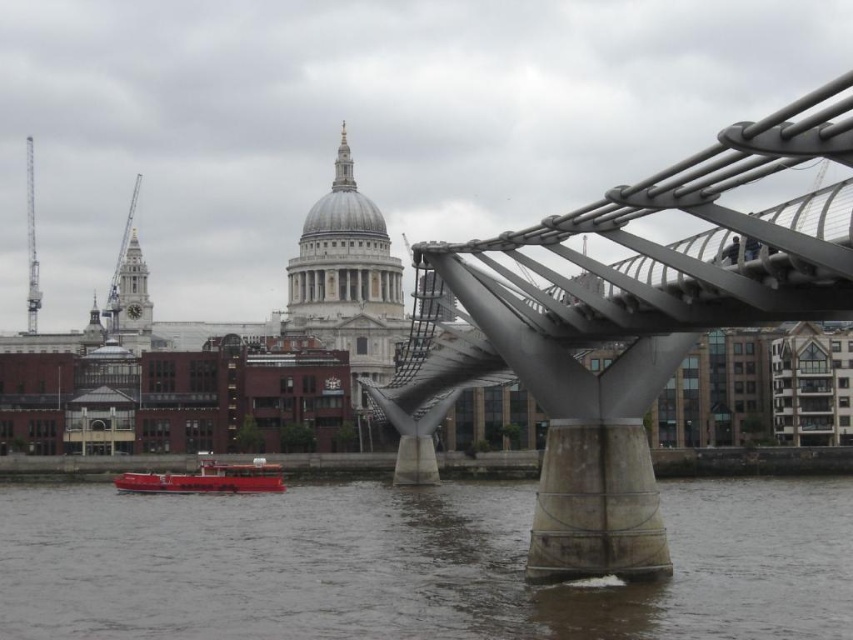
Question: Which point is closer to the camera taking this photo?

Choices:
 (A) (556, 374)
 (B) (328, 595)

Answer: (B)

Question: Which of the following is the closest to the observer?

Choices:
 (A) (621, 428)
 (B) (223, 483)

Answer: (A)

Question: Does brown concrete river at lower center appear over polished steel bridge at center?

Choices:
 (A) no
 (B) yes

Answer: (A)

Question: Does brown concrete river at lower center appear over metallic red boat at lower left?

Choices:
 (A) no
 (B) yes

Answer: (A)

Question: Which point appears closest to the camera in this image?

Choices:
 (A) (558, 461)
 (B) (155, 477)
 (C) (608, 632)

Answer: (C)

Question: Does brown concrete river at lower center come in front of metallic red boat at lower left?

Choices:
 (A) no
 (B) yes

Answer: (B)